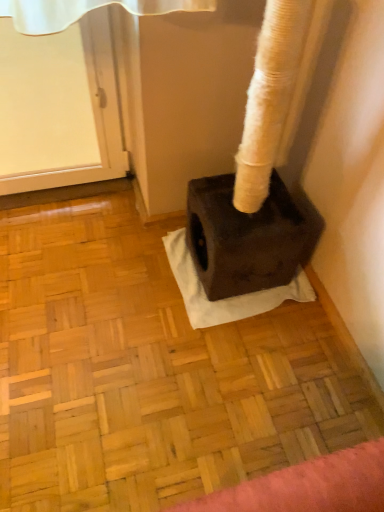
Identify the location of vacant area that is in front of dark gray fabric at center. click(237, 373).